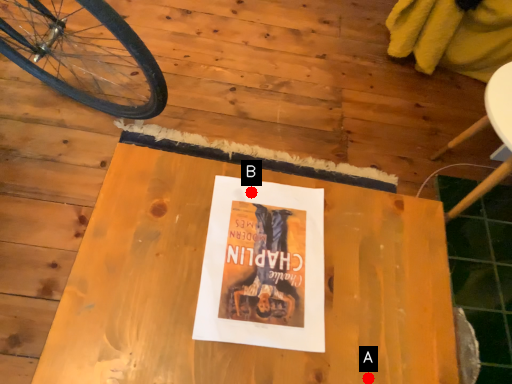
Question: Two points are circled on the image, labeled by A and B beside each circle. Which point is closer to the camera?

Choices:
 (A) A is closer
 (B) B is closer

Answer: (A)